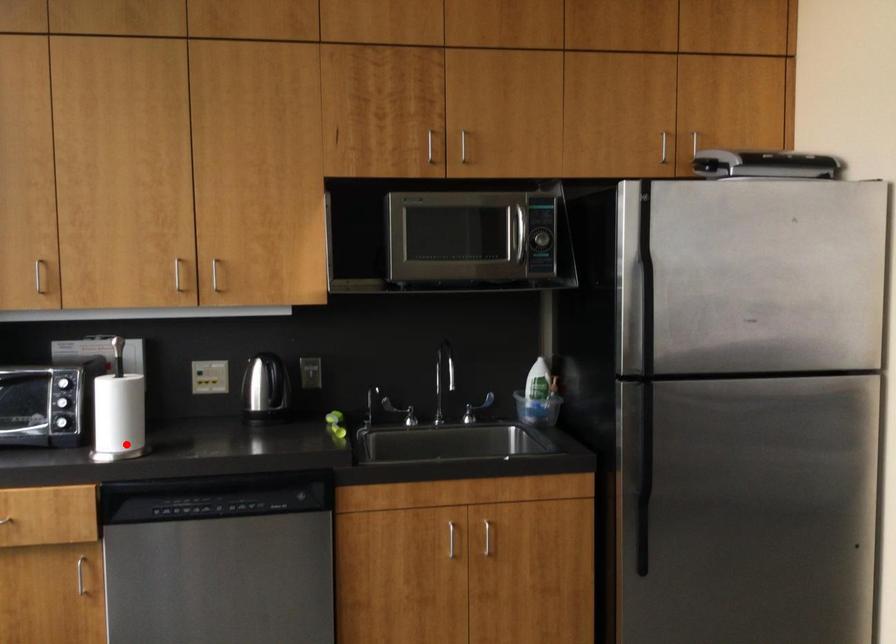
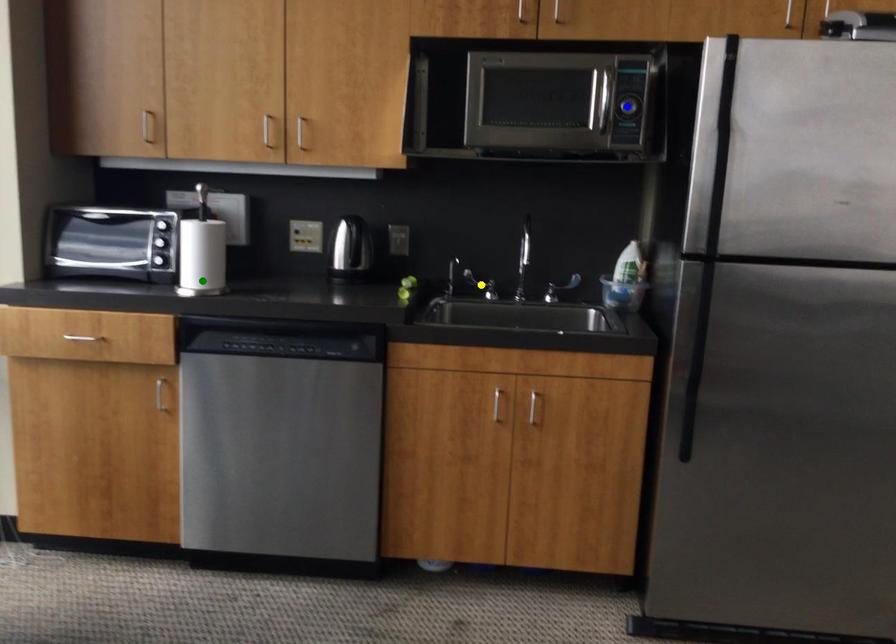
Question: I am providing you with two images of the same scene from different viewpoints. A red point is marked on the first image. You are given multiple points on the second image. Which point in image 2 represents the same 3d spot as the red point in image 1?

Choices:
 (A) green point
 (B) blue point
 (C) yellow point

Answer: (A)